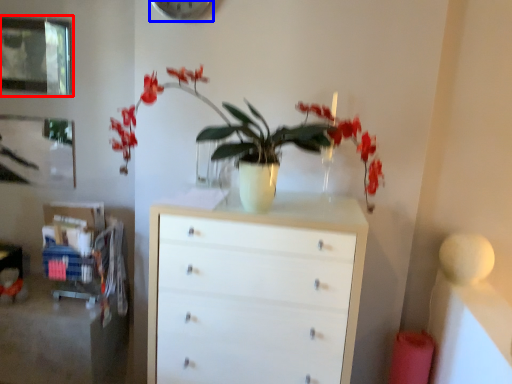
Question: Which point is further to the camera, picture frame (highlighted by a red box) or clock (highlighted by a blue box)?

Choices:
 (A) picture frame
 (B) clock

Answer: (A)